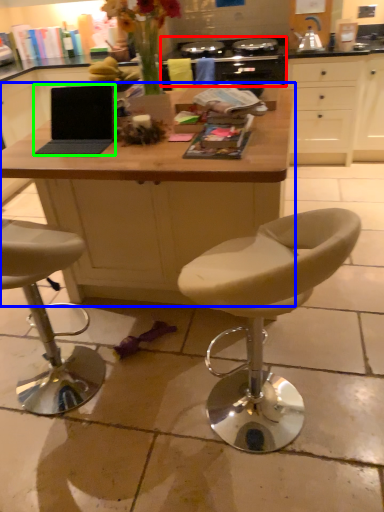
Question: Which object is positioned farthest from gas stove (highlighted by a red box)? Select from desk (highlighted by a blue box) and laptop (highlighted by a green box).

Choices:
 (A) desk
 (B) laptop

Answer: (B)